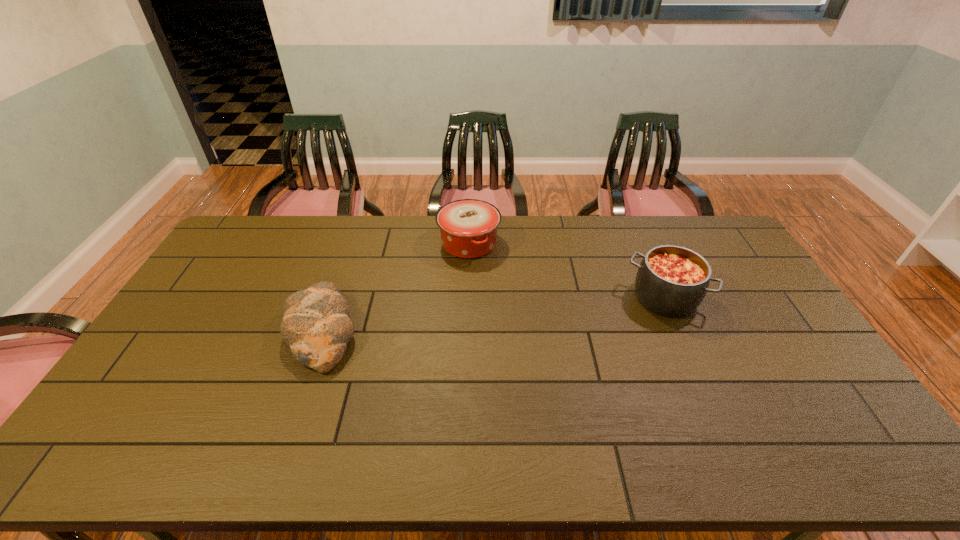
This screenshot has width=960, height=540. Find the location of `the farthest object`. the farthest object is located at coordinates (468, 227).

Locate an element on the screen. This screenshot has height=540, width=960. the left casserole is located at coordinates click(x=468, y=227).

Identify the location of the rightmost object. (672, 281).

Identify the location of the nearer casserole. (672, 281).

Locate an element on the screen. the leftmost object is located at coordinates (316, 325).

Where is `the shortest object`? The width and height of the screenshot is (960, 540). the shortest object is located at coordinates (316, 325).

Locate an element on the screen. The width and height of the screenshot is (960, 540). free space located on the front of the second object from right to left is located at coordinates tap(467, 321).

Find the location of a particular element. blank space located on the right of the right casserole is located at coordinates (737, 298).

In order to click on vacant space situated 0.350m on the left of the leftmost object in this screenshot , I will do `click(167, 332)`.

Identify the location of object situated at the far edge. (468, 227).